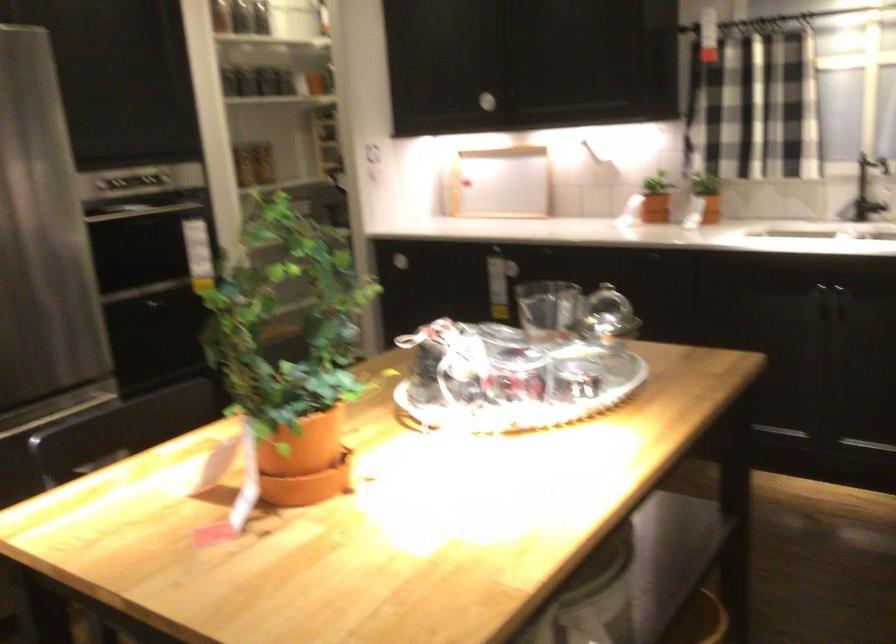
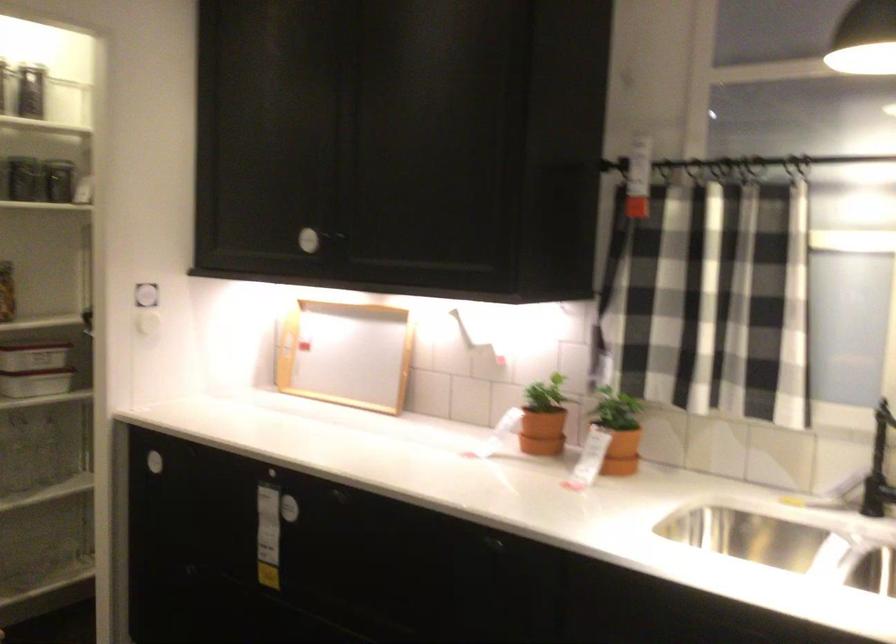
Locate, in the second image, the point that corresponds to (272,75) in the first image.

(31, 187)